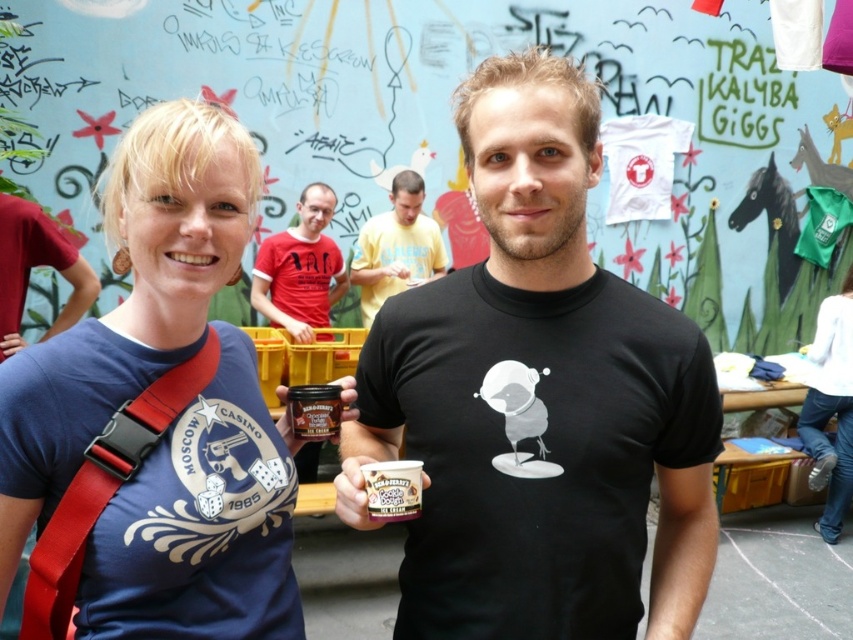
You are standing at the origin point in the image and want to reach the point labeled as point (398, 500). There is an obstacle at point (109, 506). Can you go around it to reach your destination?

Point (109, 506) is in front of point (398, 500), so you cannot go around it to reach the destination as it is blocking the path.

You are a photographer trying to capture the blue printed t shirt at upper left in the scene. The camera is positioned at the point given by coordinates point (154, 419). Can you confirm if the blue printed t shirt at upper left is visible from this position?

The blue printed t shirt at upper left is located exactly at point (154, 419), so yes, it would be visible from the camera positioned there.